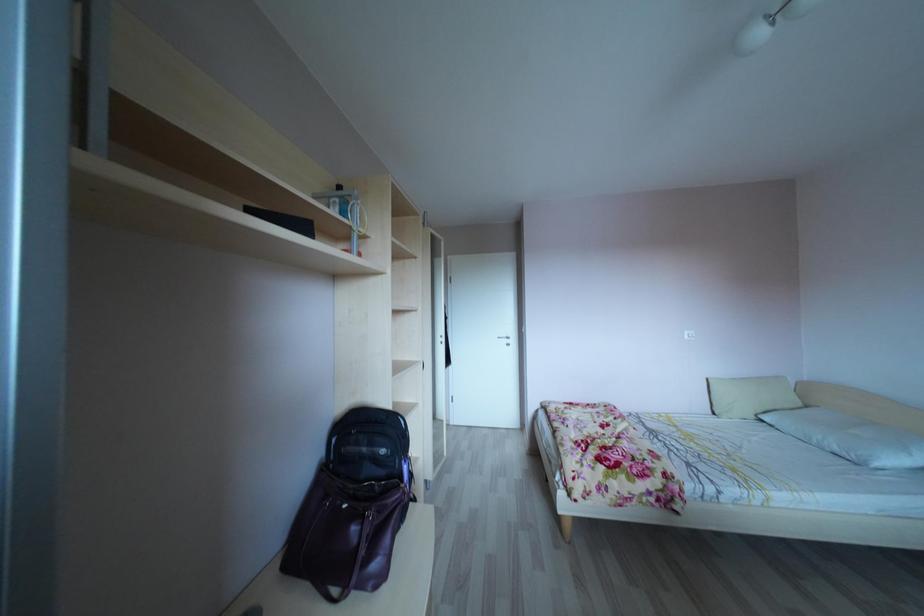
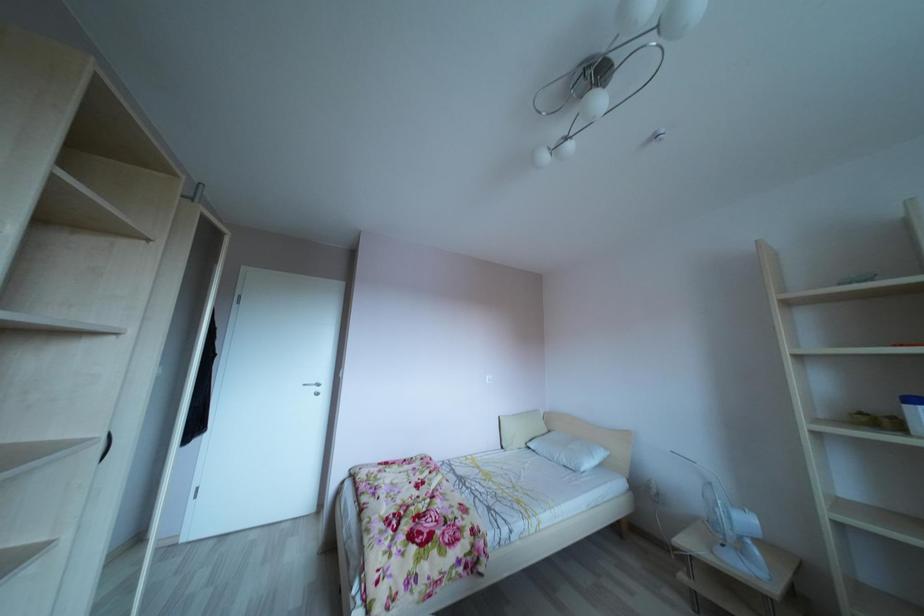
Question: The camera is either moving clockwise (left) or counter-clockwise (right) around the object. The first image is from the beginning of the video and the second image is from the end. Is the camera moving left or right when shooting the video?

Choices:
 (A) Left
 (B) Right

Answer: (A)